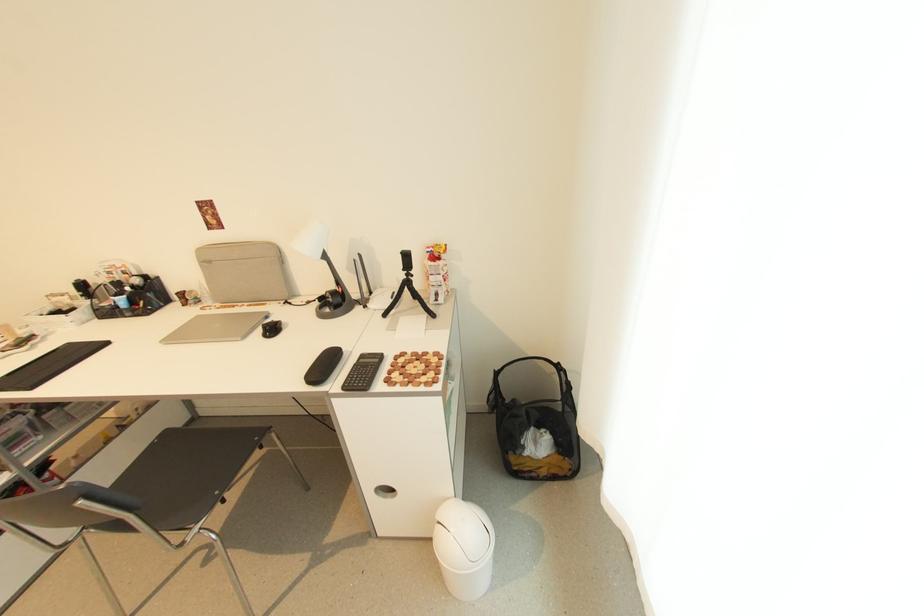
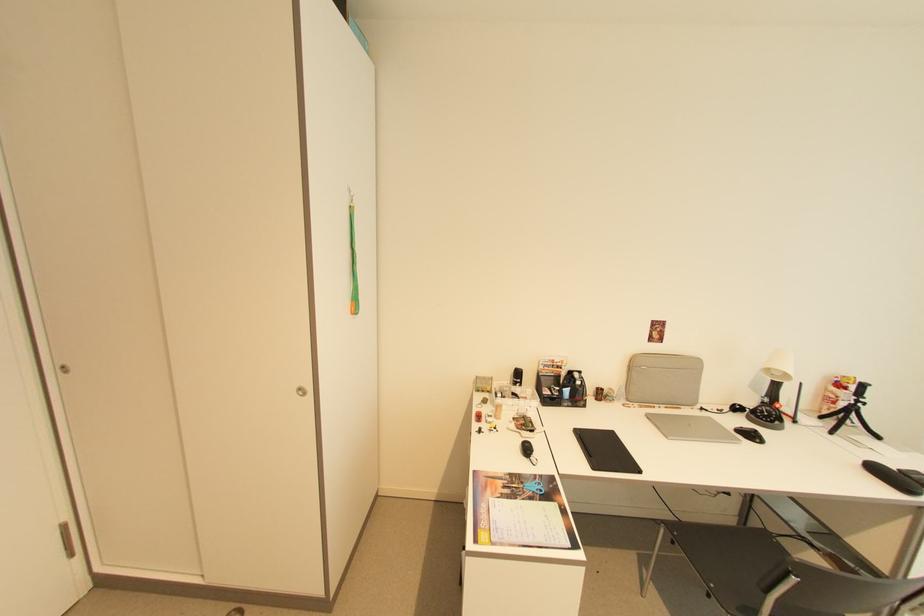
In the second image, find the point that corresponds to (410,278) in the first image.

(857, 405)